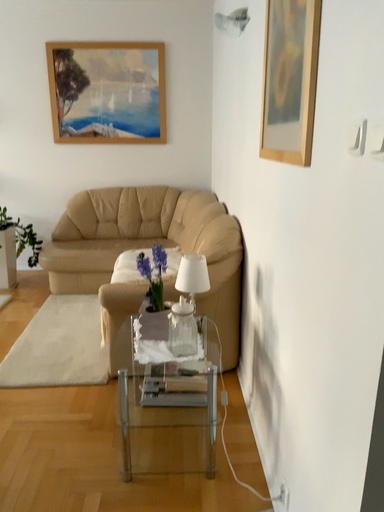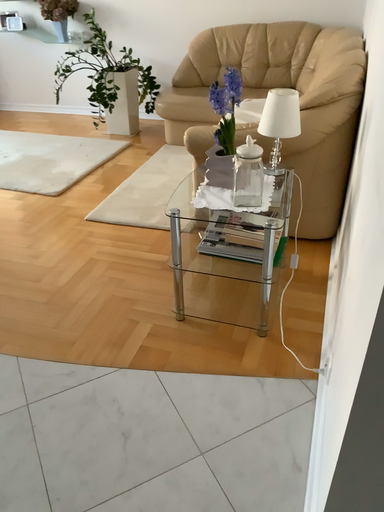
Question: How did the camera likely rotate when shooting the video?

Choices:
 (A) rotated right
 (B) rotated left

Answer: (B)